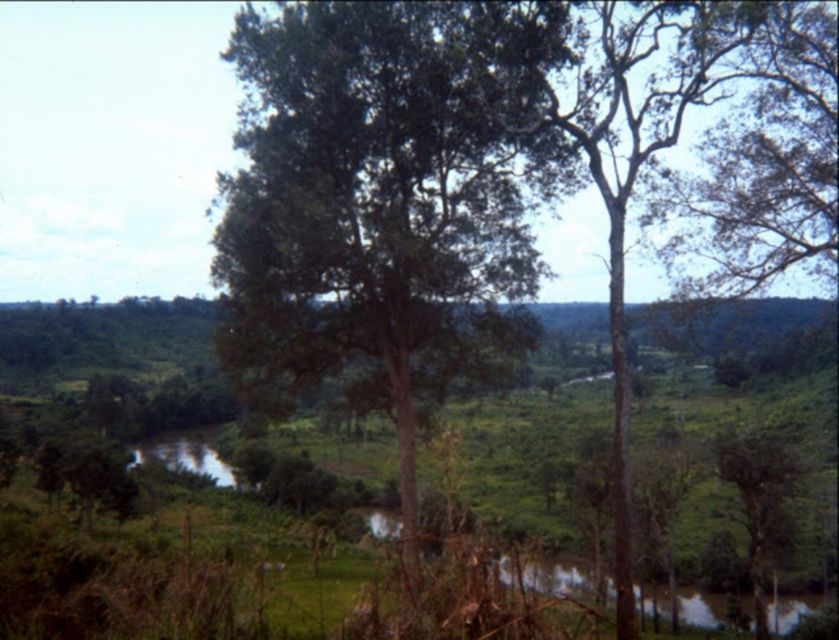
Measure the distance between green rough bark tree at center and camera.

green rough bark tree at center and camera are 16.89 meters apart from each other.

Which is more to the right, green rough bark tree at center or green matte tree at lower right?

green matte tree at lower right is more to the right.

Between point (606, 80) and point (774, 520), which one is positioned in front?

Point (606, 80) is more forward.

Identify the location of green rough bark tree at center. Image resolution: width=839 pixels, height=640 pixels. (644, 116).

Does green leafy tree at center have a lesser height compared to green matte tree at lower right?

Incorrect, green leafy tree at center's height does not fall short of green matte tree at lower right's.

Can you confirm if green leafy tree at center is wider than green matte tree at lower right?

Yes.

Find the location of a particular element. This screenshot has height=640, width=839. green leafy tree at center is located at coordinates (383, 198).

Does green leafy tree at center appear on the right side of green rough bark tree at center?

Incorrect, green leafy tree at center is not on the right side of green rough bark tree at center.

Identify the location of green leafy tree at center. Image resolution: width=839 pixels, height=640 pixels. (383, 198).

Between point (249, 205) and point (597, 17), which one is positioned in front?

Point (597, 17)

You are a GUI agent. You are given a task and a screenshot of the screen. Output one action in this format:
    pyautogui.click(x=<x>, y=<y>)
    Task: Click on the green leafy tree at center
    The width and height of the screenshot is (839, 640).
    Given the screenshot: What is the action you would take?
    pyautogui.click(x=383, y=198)